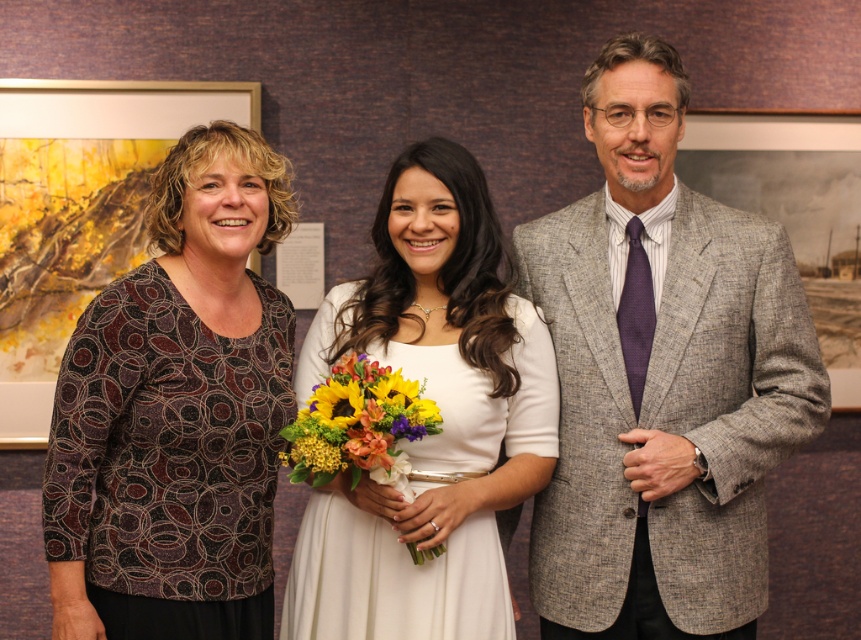
Where is the vibrant floral bouquet at center located in the image?

The vibrant floral bouquet at center is located at point 0.661 along the x axis and 0.416 along the y axis.